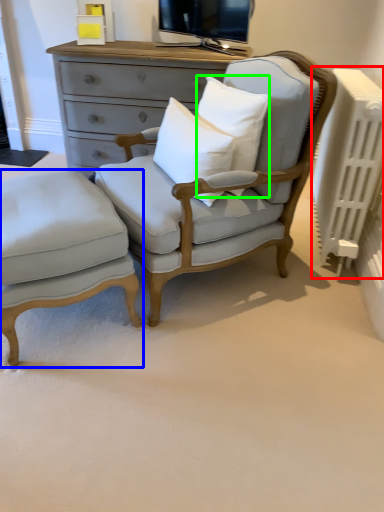
Question: Which object is the farthest from radiator (highlighted by a red box)? Choose among these: nightstand (highlighted by a blue box) or pillow (highlighted by a green box).

Choices:
 (A) nightstand
 (B) pillow

Answer: (A)